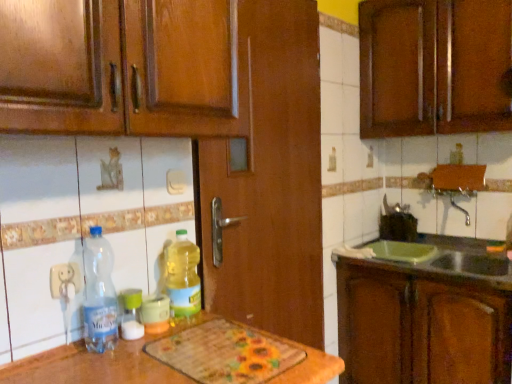
Image resolution: width=512 pixels, height=384 pixels. Describe the element at coordinates (99, 294) in the screenshot. I see `clear plastic bottle at lower left, which appears as the third bottle when viewed from the right` at that location.

This screenshot has width=512, height=384. What do you see at coordinates (450, 262) in the screenshot?
I see `green plastic sink at lower right` at bounding box center [450, 262].

What are the coordinates of `wooden cabinet at upper right, which is the 1th cabinetry in top-to-bottom order` in the screenshot? It's located at (434, 67).

Where is `translucent plastic bottle at center, which ranks as the third bottle in left-to-right order`? The width and height of the screenshot is (512, 384). translucent plastic bottle at center, which ranks as the third bottle in left-to-right order is located at coordinates (183, 276).

I want to click on clear plastic bottle at lower left, which appears as the third bottle when viewed from the right, so click(x=99, y=294).

Does point (95, 330) come farther from viewer compared to point (460, 5)?

No, (95, 330) is closer to viewer.

Can you confirm if clear plastic bottle at lower left, which appears as the third bottle when viewed from the right, is wider than wooden cabinet at upper right, placed as the 2th cabinetry when sorted from bottom to top?

No, clear plastic bottle at lower left, which appears as the third bottle when viewed from the right, is not wider than wooden cabinet at upper right, placed as the 2th cabinetry when sorted from bottom to top.

Does wooden cabinet at upper right, placed as the 2th cabinetry when sorted from bottom to top, come behind brown wood cabinet at right, the second cabinetry viewed from the top?

Yes, it is.

From their relative heights in the image, would you say wooden cabinet at upper right, which is the 1th cabinetry in top-to-bottom order, is taller or shorter than brown wood cabinet at right, marked as the first cabinetry in a bottom-to-top arrangement?

Clearly, wooden cabinet at upper right, which is the 1th cabinetry in top-to-bottom order, is shorter compared to brown wood cabinet at right, marked as the first cabinetry in a bottom-to-top arrangement.

In the scene shown: From the image's perspective, does wooden cabinet at upper right, placed as the 2th cabinetry when sorted from bottom to top, appear lower than brown wood cabinet at right, the second cabinetry viewed from the top?

No, from the image's perspective, wooden cabinet at upper right, placed as the 2th cabinetry when sorted from bottom to top, is not below brown wood cabinet at right, the second cabinetry viewed from the top.

Is wooden cabinet at upper right, placed as the 2th cabinetry when sorted from bottom to top, facing towards brown wood cabinet at right, marked as the first cabinetry in a bottom-to-top arrangement?

No.

Could you measure the distance between brown wood cabinet at right, the second cabinetry viewed from the top, and wooden cabinet at upper right, which is the 1th cabinetry in top-to-bottom order?

brown wood cabinet at right, the second cabinetry viewed from the top, is 36.92 inches from wooden cabinet at upper right, which is the 1th cabinetry in top-to-bottom order.

Is brown wood cabinet at right, marked as the first cabinetry in a bottom-to-top arrangement, in front of or behind wooden cabinet at upper right, placed as the 2th cabinetry when sorted from bottom to top, in the image?

In the image, brown wood cabinet at right, marked as the first cabinetry in a bottom-to-top arrangement, appears in front of wooden cabinet at upper right, placed as the 2th cabinetry when sorted from bottom to top.

Considering the sizes of brown wood cabinet at right, the second cabinetry viewed from the top, and wooden cabinet at upper right, placed as the 2th cabinetry when sorted from bottom to top, in the image, is brown wood cabinet at right, the second cabinetry viewed from the top, bigger or smaller than wooden cabinet at upper right, placed as the 2th cabinetry when sorted from bottom to top,?

Considering their sizes, brown wood cabinet at right, the second cabinetry viewed from the top, takes up more space than wooden cabinet at upper right, placed as the 2th cabinetry when sorted from bottom to top.

Looking at the image, does green plastic sink at lower right seem bigger or smaller compared to wooden cabinet at upper right, placed as the 2th cabinetry when sorted from bottom to top?

In the image, green plastic sink at lower right appears to be smaller than wooden cabinet at upper right, placed as the 2th cabinetry when sorted from bottom to top.

From the image's perspective, relative to wooden cabinet at upper right, placed as the 2th cabinetry when sorted from bottom to top, is green plastic sink at lower right above or below?

From the image's perspective, green plastic sink at lower right appears below wooden cabinet at upper right, placed as the 2th cabinetry when sorted from bottom to top.

Considering the relative sizes of green plastic sink at lower right and wooden cabinet at upper right, placed as the 2th cabinetry when sorted from bottom to top, in the image provided, is green plastic sink at lower right wider than wooden cabinet at upper right, placed as the 2th cabinetry when sorted from bottom to top,?

Yes.

Who is shorter, green plastic sink at lower right or wooden cabinet at upper right, which is the 1th cabinetry in top-to-bottom order?

green plastic sink at lower right is shorter.

Which object is positioned more to the right, translucent plastic bottle at center, positioned as the second bottle in right-to-left order, or brown wood cabinet at right, marked as the first cabinetry in a bottom-to-top arrangement?

brown wood cabinet at right, marked as the first cabinetry in a bottom-to-top arrangement.

Does translucent plastic bottle at center, the second bottle from the left, have a lesser height compared to brown wood cabinet at right, the second cabinetry viewed from the top?

Indeed, translucent plastic bottle at center, the second bottle from the left, has a lesser height compared to brown wood cabinet at right, the second cabinetry viewed from the top.

Can you confirm if translucent plastic bottle at center, positioned as the second bottle in right-to-left order, is thinner than brown wood cabinet at right, the second cabinetry viewed from the top?

Yes, translucent plastic bottle at center, positioned as the second bottle in right-to-left order, is thinner than brown wood cabinet at right, the second cabinetry viewed from the top.

In the image, is translucent plastic bottle at center, the second bottle from the left, positioned in front of or behind brown wood cabinet at right, marked as the first cabinetry in a bottom-to-top arrangement?

In the image, translucent plastic bottle at center, the second bottle from the left, appears in front of brown wood cabinet at right, marked as the first cabinetry in a bottom-to-top arrangement.

How many degrees apart are the facing directions of translucent plastic bottle at center, which is the 1th bottle from right to left, and clear plastic bottle at lower left, the first bottle positioned from the left?

There is a 0.00413-degree angle between the facing directions of translucent plastic bottle at center, which is the 1th bottle from right to left, and clear plastic bottle at lower left, the first bottle positioned from the left.

In the scene shown: Is translucent plastic bottle at center, which ranks as the third bottle in left-to-right order, positioned far away from clear plastic bottle at lower left, which appears as the third bottle when viewed from the right?

Actually, translucent plastic bottle at center, which ranks as the third bottle in left-to-right order, and clear plastic bottle at lower left, which appears as the third bottle when viewed from the right, are a little close together.

Which of these two, translucent plastic bottle at center, which is the 1th bottle from right to left, or clear plastic bottle at lower left, which appears as the third bottle when viewed from the right, stands taller?

Standing taller between the two is clear plastic bottle at lower left, which appears as the third bottle when viewed from the right.

Is translucent plastic bottle at center, which ranks as the third bottle in left-to-right order, positioned behind clear plastic bottle at lower left, which appears as the third bottle when viewed from the right?

Yes.

Is brown wood cabinet at right, the second cabinetry viewed from the top, far from translucent plastic bottle at center, positioned as the second bottle in right-to-left order?

Yes, brown wood cabinet at right, the second cabinetry viewed from the top, is far from translucent plastic bottle at center, positioned as the second bottle in right-to-left order.

Does brown wood cabinet at right, the second cabinetry viewed from the top, have a larger size compared to translucent plastic bottle at center, positioned as the second bottle in right-to-left order?

Indeed, brown wood cabinet at right, the second cabinetry viewed from the top, has a larger size compared to translucent plastic bottle at center, positioned as the second bottle in right-to-left order.

From the image's perspective, is brown wood cabinet at right, the second cabinetry viewed from the top, below translucent plastic bottle at center, the second bottle from the left?

Yes, from the image's perspective, brown wood cabinet at right, the second cabinetry viewed from the top, is beneath translucent plastic bottle at center, the second bottle from the left.

From the brown wood cabinet at right, the second cabinetry viewed from the top, count the 2nd bottle to the left and point to it. Please provide its 2D coordinates.

[(131, 314)]

You are a GUI agent. You are given a task and a screenshot of the screen. Output one action in this format:
    pyautogui.click(x=<x>, y=<y>)
    Task: Click on the cabinetry that is the 2nd object located behind the clear plastic bottle at lower left, the first bottle positioned from the left
    Image resolution: width=512 pixels, height=384 pixels.
    Given the screenshot: What is the action you would take?
    pyautogui.click(x=434, y=67)

The image size is (512, 384). Find the location of `cabinetry below the wooden cabinet at upper right, placed as the 2th cabinetry when sorted from bottom to top (from a real-world perspective)`. cabinetry below the wooden cabinet at upper right, placed as the 2th cabinetry when sorted from bottom to top (from a real-world perspective) is located at coordinates (420, 325).

Based on their spatial positions, is translucent plastic bottle at center, which is the 1th bottle from right to left, or clear plastic bottle at lower left, the first bottle positioned from the left, further from green plastic sink at lower right?

The object further to green plastic sink at lower right is clear plastic bottle at lower left, the first bottle positioned from the left.

Estimate the real-world distances between objects in this image. Which object is closer to clear plastic bottle at lower left, the first bottle positioned from the left, translucent plastic bottle at center, which ranks as the third bottle in left-to-right order, or brown wood cabinet at right, the second cabinetry viewed from the top?

translucent plastic bottle at center, which ranks as the third bottle in left-to-right order, is closer to clear plastic bottle at lower left, the first bottle positioned from the left.

When comparing their distances from green plastic sink at lower right, does clear plastic bottle at lower left, which appears as the third bottle when viewed from the right, or wooden cabinet at upper right, placed as the 2th cabinetry when sorted from bottom to top, seem closer?

Based on the image, wooden cabinet at upper right, placed as the 2th cabinetry when sorted from bottom to top, appears to be nearer to green plastic sink at lower right.

Looking at the image, which one is located closer to clear plastic bottle at lower left, which appears as the third bottle when viewed from the right, green plastic sink at lower right or translucent plastic bottle at center, which ranks as the third bottle in left-to-right order?

Among the two, translucent plastic bottle at center, which ranks as the third bottle in left-to-right order, is located nearer to clear plastic bottle at lower left, which appears as the third bottle when viewed from the right.

From the picture: Considering their positions, is brown wood cabinet at right, the second cabinetry viewed from the top, positioned closer to clear plastic bottle at lower left, the first bottle positioned from the left, than translucent plastic bottle at center, positioned as the second bottle in right-to-left order?

translucent plastic bottle at center, positioned as the second bottle in right-to-left order.

Consider the image. Looking at the image, which one is located closer to green plastic sink at lower right, translucent plastic bottle at center, the second bottle from the left, or clear plastic bottle at lower left, the first bottle positioned from the left?

translucent plastic bottle at center, the second bottle from the left, lies closer to green plastic sink at lower right than the other object.

From the image, which object appears to be nearer to wooden cabinet at upper right, placed as the 2th cabinetry when sorted from bottom to top, green plastic sink at lower right or brown wood cabinet at right, the second cabinetry viewed from the top?

Based on the image, green plastic sink at lower right appears to be nearer to wooden cabinet at upper right, placed as the 2th cabinetry when sorted from bottom to top.

Looking at the image, which one is located closer to clear plastic bottle at lower left, the first bottle positioned from the left, translucent plastic bottle at center, positioned as the second bottle in right-to-left order, or green plastic sink at lower right?

translucent plastic bottle at center, positioned as the second bottle in right-to-left order, is positioned closer to the anchor clear plastic bottle at lower left, the first bottle positioned from the left.

Locate an element on the screen. Image resolution: width=512 pixels, height=384 pixels. sink between translucent plastic bottle at center, which ranks as the third bottle in left-to-right order, and wooden cabinet at upper right, placed as the 2th cabinetry when sorted from bottom to top is located at coordinates (450, 262).

At what (x,y) coordinates should I click in order to perform the action: click on bottle between translucent plastic bottle at center, positioned as the second bottle in right-to-left order, and brown wood cabinet at right, marked as the first cabinetry in a bottom-to-top arrangement. Please return your answer as a coordinate pair (x, y). The width and height of the screenshot is (512, 384). Looking at the image, I should click on coord(183,276).

Where is `bottle located between translucent plastic bottle at center, the second bottle from the left, and wooden cabinet at upper right, placed as the 2th cabinetry when sorted from bottom to top, in the left-right direction`? Image resolution: width=512 pixels, height=384 pixels. bottle located between translucent plastic bottle at center, the second bottle from the left, and wooden cabinet at upper right, placed as the 2th cabinetry when sorted from bottom to top, in the left-right direction is located at coordinates (183, 276).

The height and width of the screenshot is (384, 512). I want to click on sink between wooden cabinet at upper right, which is the 1th cabinetry in top-to-bottom order, and brown wood cabinet at right, marked as the first cabinetry in a bottom-to-top arrangement, in the vertical direction, so click(450, 262).